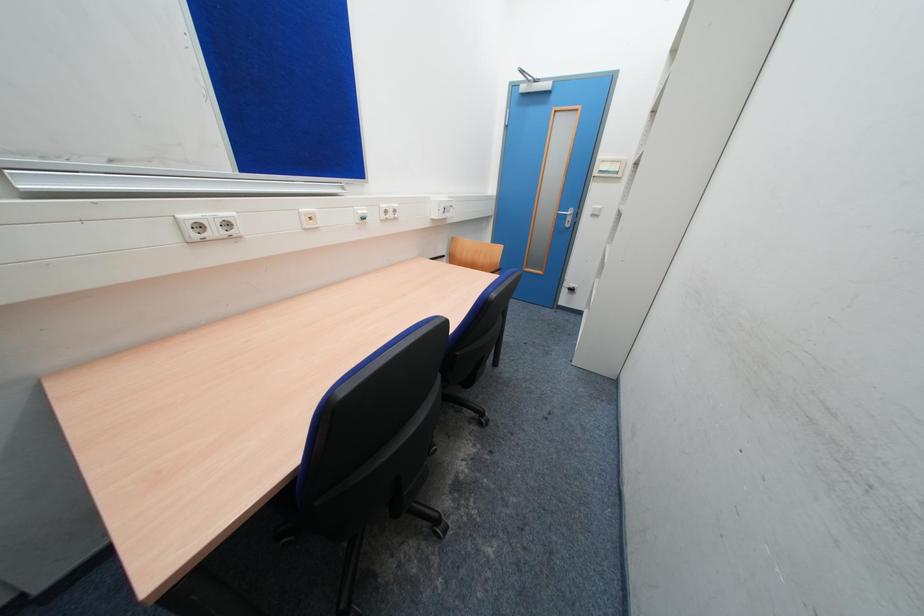
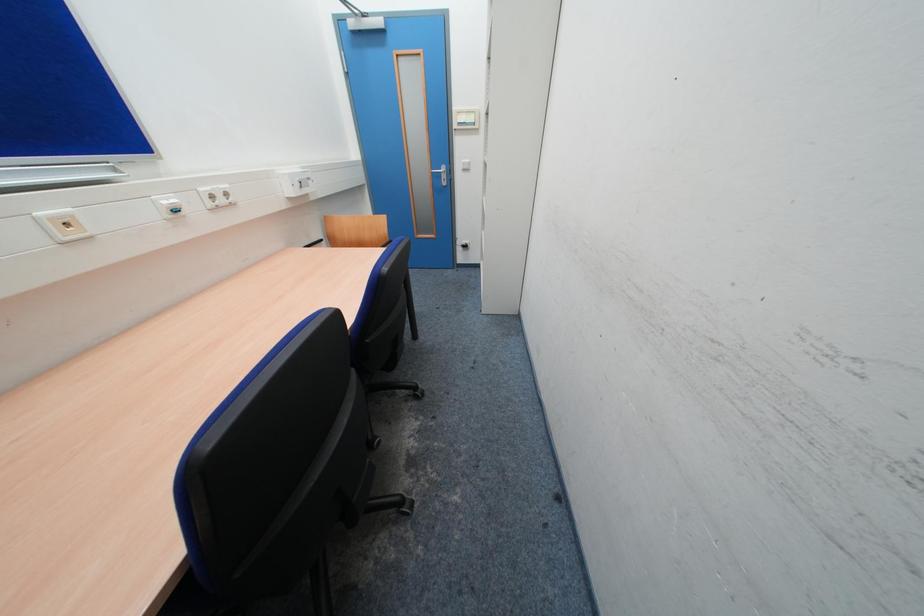
What movement of the cameraman would produce the second image?

The cameraman walked toward right, forward.